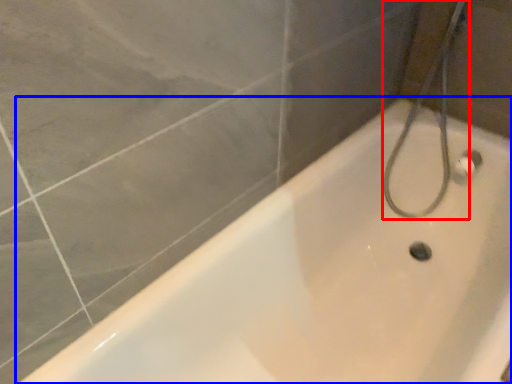
Question: Which object is further to the camera taking this photo, shower (highlighted by a red box) or bathtub (highlighted by a blue box)?

Choices:
 (A) shower
 (B) bathtub

Answer: (A)